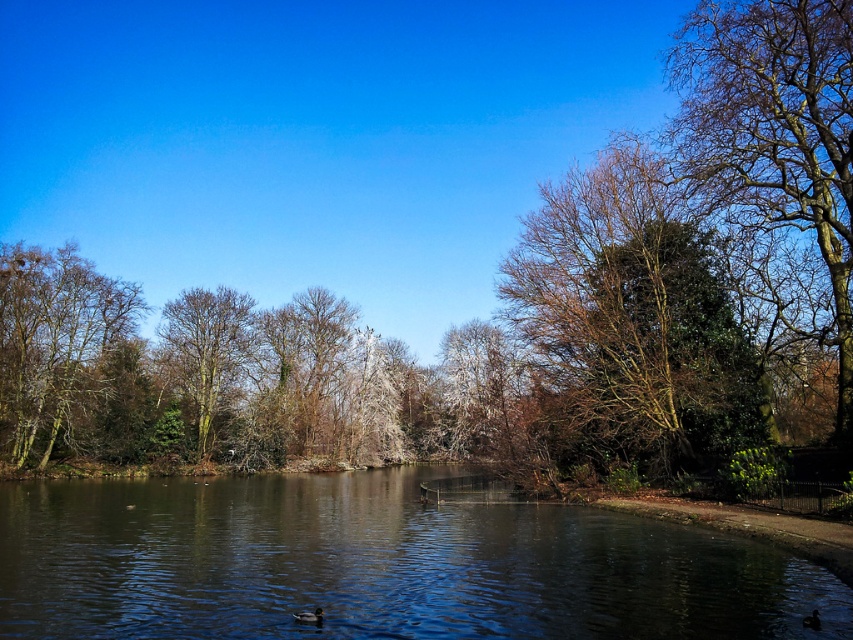
You are standing at the edge of the pond and notice the smooth bark tree at center and the dark brown glossy duck at lower center. Which object is taller?

The smooth bark tree at center is taller than the dark brown glossy duck at lower center according to the description.

You are a photographer aiming to capture a clear shot of the dark brown glossy duck at lower center without the brown textured tree at center blocking it. How should you adjust your camera position?

Move your camera position below the current angle so that the dark brown glossy duck at lower center is no longer obscured by the brown textured tree at center, which is currently positioned over it.